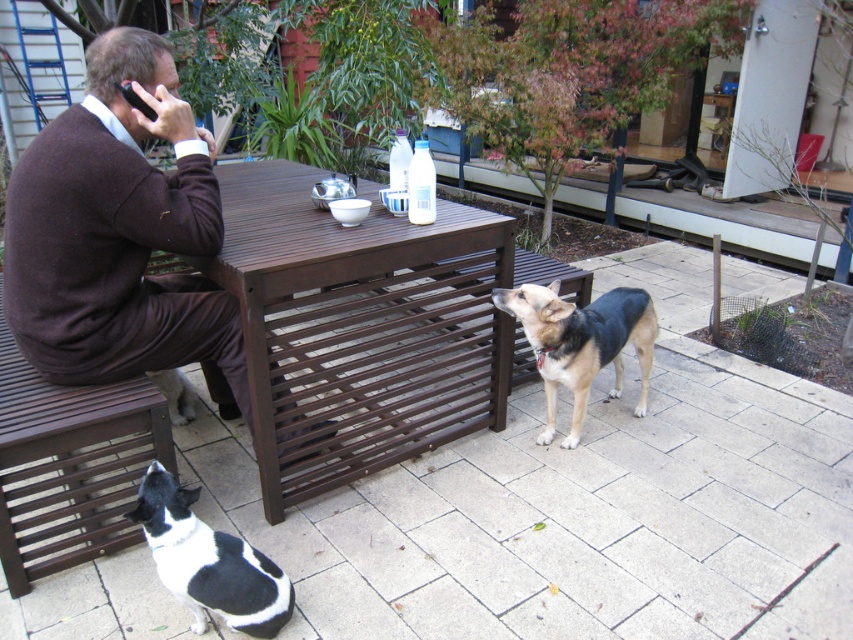
Question: Is brown wooden table at center further to camera compared to brown wool sweater at left?

Choices:
 (A) yes
 (B) no

Answer: (A)

Question: Does brown wooden bench at left appear on the left side of tan and black fur dog at center?

Choices:
 (A) yes
 (B) no

Answer: (A)

Question: Which of the following is the farthest from the observer?

Choices:
 (A) (181, 376)
 (B) (544, 394)

Answer: (A)

Question: Is brown wooden bench at left to the right of black fur dog at lower left from the viewer's perspective?

Choices:
 (A) no
 (B) yes

Answer: (A)

Question: Which point is closer to the camera taking this photo?

Choices:
 (A) (593, 368)
 (B) (225, 536)

Answer: (B)

Question: Which object appears closest to the camera in this image?

Choices:
 (A) tan and black fur dog at center
 (B) brown wooden bench at left
 (C) brown wool sweater at left
 (D) black and white fur dog at lower left

Answer: (D)